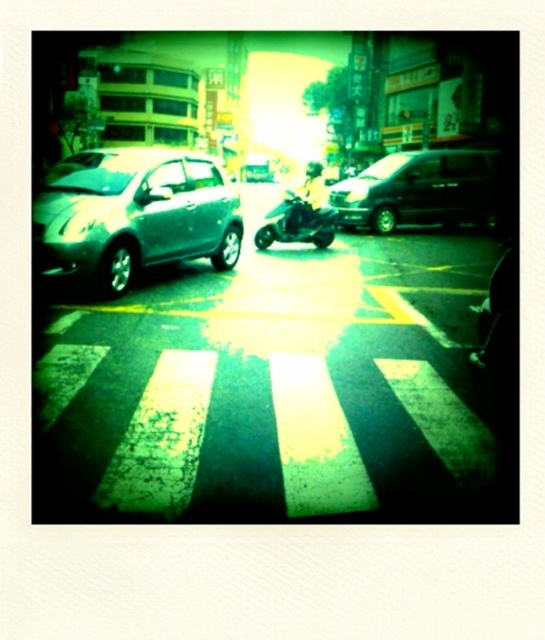
Question: Which of the following is the closest to the observer?

Choices:
 (A) black matte van at center
 (B) satin silver car at left

Answer: (B)

Question: Is black matte van at center smaller than green matte motorcycle at center?

Choices:
 (A) yes
 (B) no

Answer: (B)

Question: Does black matte van at center have a larger size compared to green matte motorcycle at center?

Choices:
 (A) yes
 (B) no

Answer: (A)

Question: Among these objects, which one is farthest from the camera?

Choices:
 (A) green matte motorcycle at center
 (B) satin silver car at left

Answer: (A)

Question: Observing the image, what is the correct spatial positioning of satin silver car at left in reference to black matte van at center?

Choices:
 (A) below
 (B) above

Answer: (A)

Question: Among these points, which one is farthest from the camera?

Choices:
 (A) (x=63, y=188)
 (B) (x=398, y=184)
 (C) (x=323, y=244)

Answer: (B)